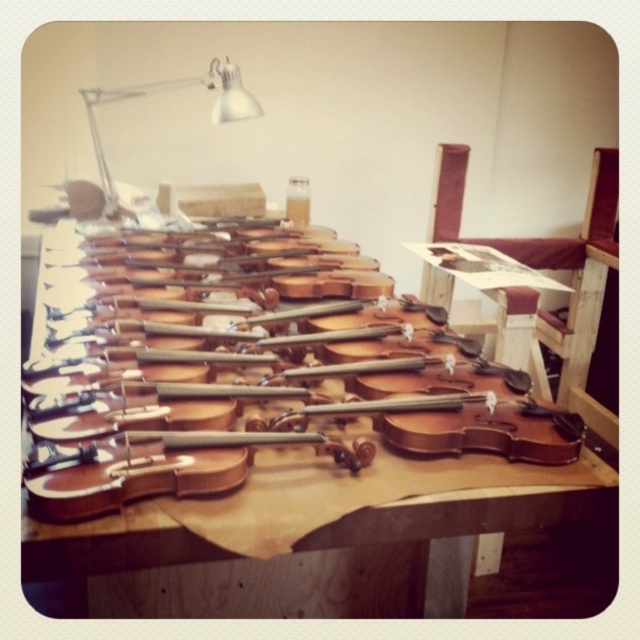
Can you confirm if natural wood violin at center is bigger than metallic silver lamp at upper left?

Indeed, natural wood violin at center has a larger size compared to metallic silver lamp at upper left.

Between natural wood violin at center and metallic silver lamp at upper left, which one has more height?

With more height is metallic silver lamp at upper left.

This screenshot has height=640, width=640. Describe the element at coordinates (241, 387) in the screenshot. I see `natural wood violin at center` at that location.

The width and height of the screenshot is (640, 640). I want to click on natural wood violin at center, so click(241, 387).